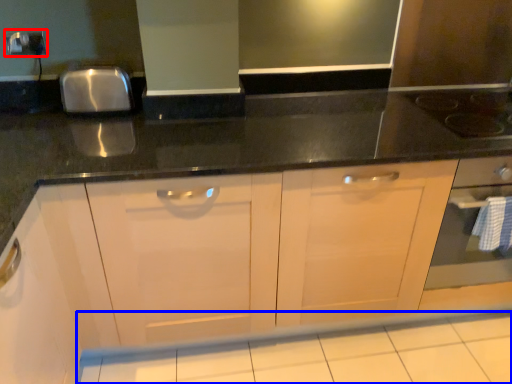
Question: Among these objects, which one is farthest to the camera, electric outlet (highlighted by a red box) or tile (highlighted by a blue box)?

Choices:
 (A) electric outlet
 (B) tile

Answer: (A)